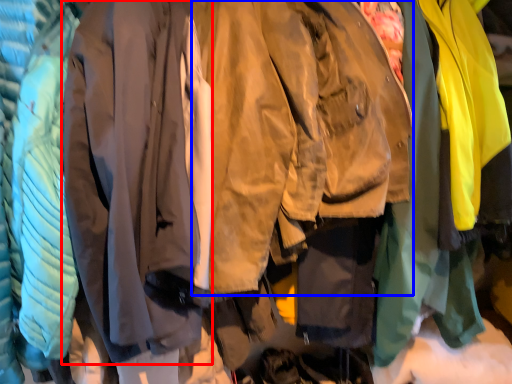
Question: Which object is closer to the camera taking this photo, sweatshirt (highlighted by a red box) or sweatshirt (highlighted by a blue box)?

Choices:
 (A) sweatshirt
 (B) sweatshirt

Answer: (A)